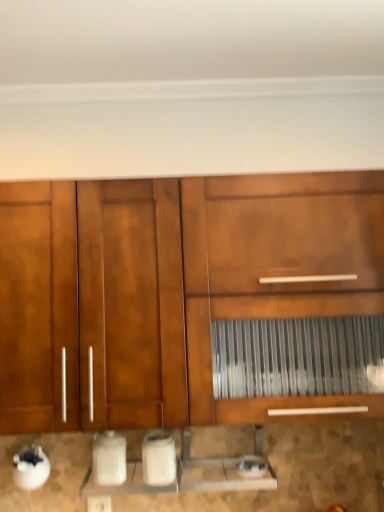
This screenshot has height=512, width=384. Describe the element at coordinates (109, 458) in the screenshot. I see `white glossy container at lower left, the first appliance viewed from the left` at that location.

From the picture: Measure the distance between point (311, 233) and camera.

Point (311, 233) is 1.24 meters away from camera.

In order to face white plastic electric outlet at lower center, should I rotate leftwards or rightwards?

To face it directly, rotate left by 12.373 degrees.

Describe the element at coordinates (99, 503) in the screenshot. I see `white plastic electric outlet at lower center` at that location.

Locate an element on the screen. white glossy container at lower left, acting as the 3th appliance starting from the right is located at coordinates (109, 458).

Looking at this image, is white plastic electric outlet at lower center positioned far away from satin silver toaster at lower center, which is counted as the 1th appliance, starting from the right?

They are positioned close to each other.

Do you think white plastic electric outlet at lower center is within satin silver toaster at lower center, which is counted as the 1th appliance, starting from the right, or outside of it?

white plastic electric outlet at lower center cannot be found inside satin silver toaster at lower center, which is counted as the 1th appliance, starting from the right.

Is satin silver toaster at lower center, which is counted as the 1th appliance, starting from the right, at the back of white plastic electric outlet at lower center?

That's not correct — white plastic electric outlet at lower center is not looking away from satin silver toaster at lower center, which is counted as the 1th appliance, starting from the right.

Which point is more distant from viewer, (x=94, y=504) or (x=256, y=465)?

The point (x=94, y=504) is farther.

Is the depth of white glossy container at lower left, acting as the 3th appliance starting from the right, less than that of matte wood cabinet at center?

No, white glossy container at lower left, acting as the 3th appliance starting from the right, is further to the viewer.

From a real-world perspective, is white plastic electric outlet at lower center positioned under matte wood cabinet at center based on gravity?

Yes.

Based on the photo, considering the positions of objects white plastic electric outlet at lower center and matte wood cabinet at center in the image provided, who is more to the left, white plastic electric outlet at lower center or matte wood cabinet at center?

Positioned to the left is white plastic electric outlet at lower center.

Considering the sizes of white plastic electric outlet at lower center and matte wood cabinet at center in the image, is white plastic electric outlet at lower center taller or shorter than matte wood cabinet at center?

white plastic electric outlet at lower center is shorter than matte wood cabinet at center.

Considering the points (104, 506) and (4, 372), which point is behind, point (104, 506) or point (4, 372)?

The point (104, 506) is more distant.

From a real-world perspective, is matte wood cabinet at center physically below white glossy container at lower left, acting as the 3th appliance starting from the right?

No, from a real-world perspective, matte wood cabinet at center is not beneath white glossy container at lower left, acting as the 3th appliance starting from the right.

Where is `appliance that is the 2nd object to the left of the matte wood cabinet at center, starting at the anchor`? appliance that is the 2nd object to the left of the matte wood cabinet at center, starting at the anchor is located at coordinates (109, 458).

Is matte wood cabinet at center not near white glossy container at lower left, acting as the 3th appliance starting from the right?

No, matte wood cabinet at center is not far from white glossy container at lower left, acting as the 3th appliance starting from the right.

Measure the distance from matte wood cabinet at center to white glossy container at lower left, acting as the 3th appliance starting from the right.

matte wood cabinet at center is 22.25 inches away from white glossy container at lower left, acting as the 3th appliance starting from the right.

Does satin silver toaster at lower center, which is counted as the 1th appliance, starting from the right, have a greater width compared to matte wood cabinet at center?

Incorrect, the width of satin silver toaster at lower center, which is counted as the 1th appliance, starting from the right, does not surpass that of matte wood cabinet at center.

Considering the relative sizes of satin silver toaster at lower center, which is counted as the 1th appliance, starting from the right, and matte wood cabinet at center in the image provided, is satin silver toaster at lower center, which is counted as the 1th appliance, starting from the right, shorter than matte wood cabinet at center?

Yes.

Could you tell me if satin silver toaster at lower center, which is the 3th appliance from left to right, is turned towards matte wood cabinet at center?

No, satin silver toaster at lower center, which is the 3th appliance from left to right, is not turned towards matte wood cabinet at center.

From the image's perspective, which appliance is the 3rd one below the matte wood cabinet at center? Please provide its 2D coordinates.

[(251, 466)]

Considering the positions of points (143, 473) and (106, 443), is point (143, 473) closer to camera compared to point (106, 443)?

No.

Looking at their sizes, would you say white glossy toaster at lower center, which appears as the 2th appliance when viewed from the left, is wider or thinner than white glossy container at lower left, acting as the 3th appliance starting from the right?

Clearly, white glossy toaster at lower center, which appears as the 2th appliance when viewed from the left, has more width compared to white glossy container at lower left, acting as the 3th appliance starting from the right.

From a real-world perspective, between white glossy toaster at lower center, which appears as the 2th appliance when viewed from the left, and white glossy container at lower left, the first appliance viewed from the left, who is vertically higher?

From a 3D spatial view, white glossy toaster at lower center, which appears as the 2th appliance when viewed from the left, is above.

Considering the relative sizes of white glossy toaster at lower center, which is counted as the second appliance, starting from the right, and white glossy container at lower left, acting as the 3th appliance starting from the right, in the image provided, is white glossy toaster at lower center, which is counted as the second appliance, starting from the right, shorter than white glossy container at lower left, acting as the 3th appliance starting from the right,?

In fact, white glossy toaster at lower center, which is counted as the second appliance, starting from the right, may be taller than white glossy container at lower left, acting as the 3th appliance starting from the right.

Who is smaller, white glossy toaster at lower center, which is counted as the second appliance, starting from the right, or satin silver toaster at lower center, which is the 3th appliance from left to right?

Smaller between the two is satin silver toaster at lower center, which is the 3th appliance from left to right.

Is white glossy toaster at lower center, which appears as the 2th appliance when viewed from the left, to the left of satin silver toaster at lower center, which is the 3th appliance from left to right, from the viewer's perspective?

Yes, white glossy toaster at lower center, which appears as the 2th appliance when viewed from the left, is to the left of satin silver toaster at lower center, which is the 3th appliance from left to right.

Are white glossy toaster at lower center, which appears as the 2th appliance when viewed from the left, and satin silver toaster at lower center, which is the 3th appliance from left to right, located far from each other?

→ Actually, white glossy toaster at lower center, which appears as the 2th appliance when viewed from the left, and satin silver toaster at lower center, which is the 3th appliance from left to right, are a little close together.

Measure the distance from white glossy toaster at lower center, which appears as the 2th appliance when viewed from the left, to satin silver toaster at lower center, which is the 3th appliance from left to right.

They are 10.45 inches apart.

I want to click on the 1st appliance in front of the white plastic electric outlet at lower center, so click(x=251, y=466).

I want to click on cabinetry above the white glossy container at lower left, the first appliance viewed from the left (from a real-world perspective), so click(x=191, y=298).

Based on the photo, when comparing their distances from white glossy toaster at lower center, which appears as the 2th appliance when viewed from the left, does satin silver toaster at lower center, which is counted as the 1th appliance, starting from the right, or white plastic electric outlet at lower center seem further?

satin silver toaster at lower center, which is counted as the 1th appliance, starting from the right, lies further to white glossy toaster at lower center, which appears as the 2th appliance when viewed from the left, than the other object.

From the image, which object appears to be farther from white plastic electric outlet at lower center, white glossy toaster at lower center, which is counted as the second appliance, starting from the right, or matte wood cabinet at center?

matte wood cabinet at center.

Looking at the image, which one is located further to white glossy toaster at lower center, which appears as the 2th appliance when viewed from the left, matte wood cabinet at center or white glossy container at lower left, acting as the 3th appliance starting from the right?

matte wood cabinet at center is further to white glossy toaster at lower center, which appears as the 2th appliance when viewed from the left.

Based on their spatial positions, is matte wood cabinet at center or satin silver toaster at lower center, which is the 3th appliance from left to right, closer to white glossy toaster at lower center, which appears as the 2th appliance when viewed from the left?

Based on the image, satin silver toaster at lower center, which is the 3th appliance from left to right, appears to be nearer to white glossy toaster at lower center, which appears as the 2th appliance when viewed from the left.

Which object lies further to the anchor point white plastic electric outlet at lower center, white glossy container at lower left, acting as the 3th appliance starting from the right, or satin silver toaster at lower center, which is counted as the 1th appliance, starting from the right?

satin silver toaster at lower center, which is counted as the 1th appliance, starting from the right, is further to white plastic electric outlet at lower center.

Consider the image. Looking at the image, which one is located closer to matte wood cabinet at center, white glossy container at lower left, the first appliance viewed from the left, or satin silver toaster at lower center, which is the 3th appliance from left to right?

white glossy container at lower left, the first appliance viewed from the left.

When comparing their distances from white glossy container at lower left, acting as the 3th appliance starting from the right, does white plastic electric outlet at lower center or white glossy toaster at lower center, which is counted as the second appliance, starting from the right, seem further?

white plastic electric outlet at lower center is further to white glossy container at lower left, acting as the 3th appliance starting from the right.

Looking at the image, which one is located further to satin silver toaster at lower center, which is counted as the 1th appliance, starting from the right, white glossy toaster at lower center, which appears as the 2th appliance when viewed from the left, or white plastic electric outlet at lower center?

white plastic electric outlet at lower center is positioned further to the anchor satin silver toaster at lower center, which is counted as the 1th appliance, starting from the right.

Image resolution: width=384 pixels, height=512 pixels. Find the location of `appliance between matte wood cabinet at center and white glossy container at lower left, the first appliance viewed from the left, vertically`. appliance between matte wood cabinet at center and white glossy container at lower left, the first appliance viewed from the left, vertically is located at coordinates tap(158, 458).

The height and width of the screenshot is (512, 384). I want to click on appliance located between white glossy container at lower left, acting as the 3th appliance starting from the right, and satin silver toaster at lower center, which is counted as the 1th appliance, starting from the right, in the left-right direction, so click(158, 458).